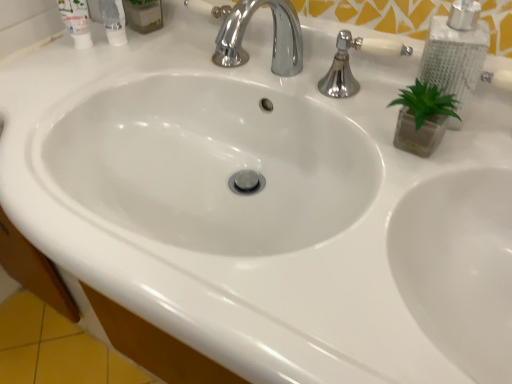
This screenshot has height=384, width=512. I want to click on free location in front of white plastic mouthwash at upper left, the second mouthwash positioned from the left, so click(106, 92).